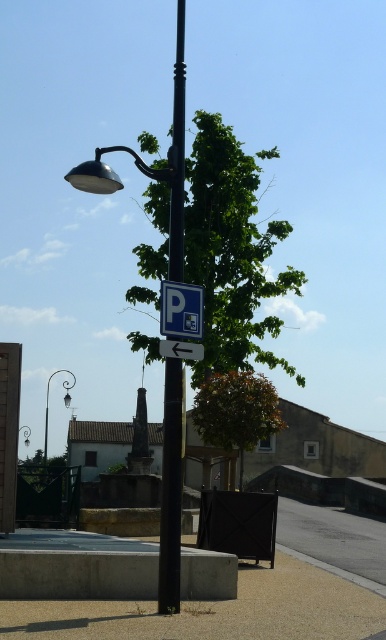
Question: Does green leafy tree at center have a greater width compared to metallic street light at upper left?

Choices:
 (A) yes
 (B) no

Answer: (B)

Question: Is metallic pole at center below polished brass street light at upper left?

Choices:
 (A) yes
 (B) no

Answer: (B)

Question: Which object is closer to the camera taking this photo?

Choices:
 (A) polished brass street light at upper left
 (B) blue plastic parking sign at upper center
 (C) green leafy tree at center
 (D) white plastic arrow at center

Answer: (D)

Question: Which point is closer to the camera taking this photo?

Choices:
 (A) (186, 342)
 (B) (184, 285)
 (C) (25, 444)

Answer: (A)

Question: Does smooth concrete pavement at lower center appear under metallic pole at center?

Choices:
 (A) no
 (B) yes

Answer: (B)

Question: Considering the real-world distances, which object is closest to the green leafy tree at center?

Choices:
 (A) metallic pole at center
 (B) smooth concrete pavement at lower center

Answer: (B)